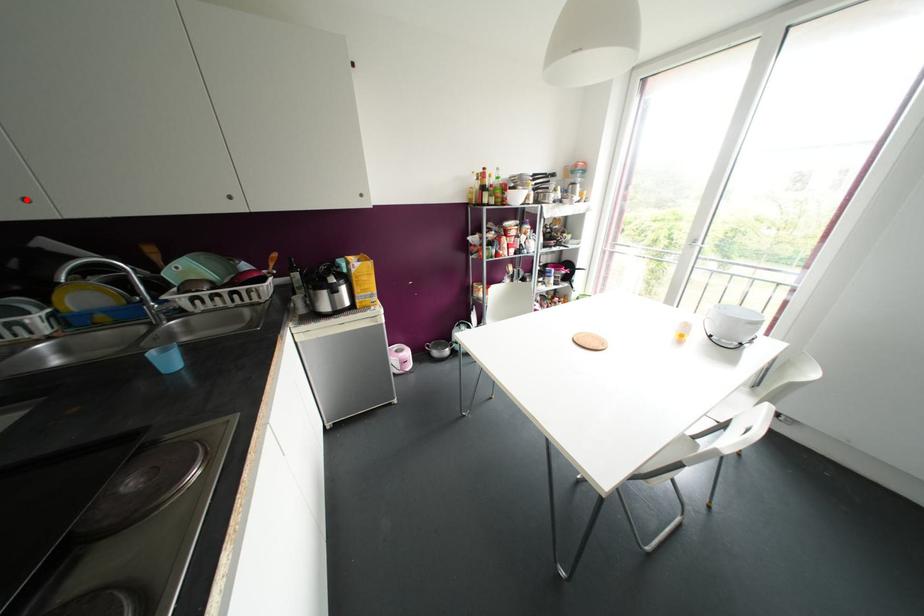
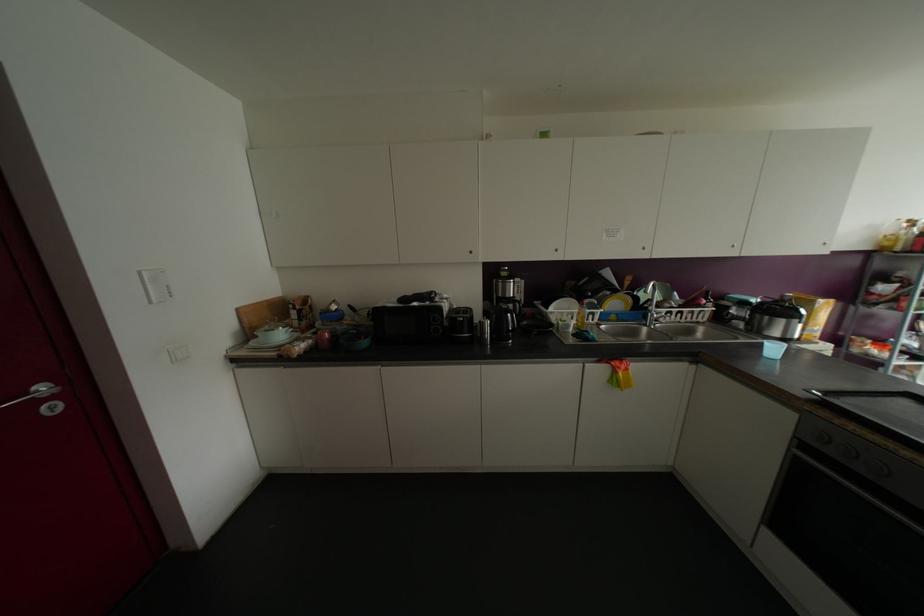
Question: I am providing you with two images of the same scene from different viewpoints. Given a red point in image1, look at the same physical point in image2. Is it:

Choices:
 (A) Closer to the viewpoint
 (B) Farther from the viewpoint

Answer: (A)